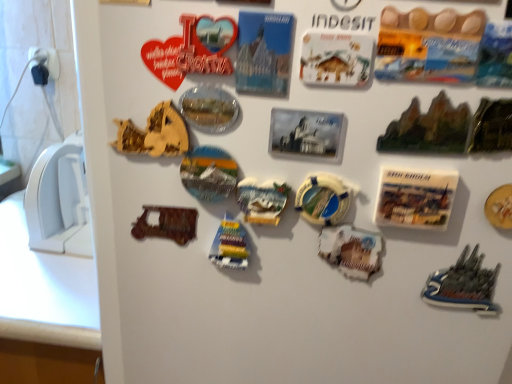
Question: Is wooden toy boat at center, marked as the 6th stuff in a right-to-left arrangement, shorter than wooden puzzle piece at upper left, acting as the 1th stuff starting from the left?

Choices:
 (A) yes
 (B) no

Answer: (B)

Question: From a real-world perspective, is wooden toy boat at center, marked as the 2th stuff in a left-to-right arrangement, below wooden puzzle piece at upper left, which is the 7th stuff from right to left?

Choices:
 (A) no
 (B) yes

Answer: (B)

Question: From the image's perspective, is wooden toy boat at center, marked as the 6th stuff in a right-to-left arrangement, over wooden puzzle piece at upper left, which is the 7th stuff from right to left?

Choices:
 (A) no
 (B) yes

Answer: (A)

Question: Is wooden toy boat at center, marked as the 6th stuff in a right-to-left arrangement, far away from wooden puzzle piece at upper left, acting as the 1th stuff starting from the left?

Choices:
 (A) no
 (B) yes

Answer: (A)

Question: Is wooden toy boat at center, marked as the 6th stuff in a right-to-left arrangement, taller than wooden puzzle piece at upper left, acting as the 1th stuff starting from the left?

Choices:
 (A) no
 (B) yes

Answer: (B)

Question: Is yellow lifebuoy at center, which is counted as the 4th stuff, starting from the left, bigger or smaller than metallic silver magnet at center, which ranks as the third stuff in left-to-right order?

Choices:
 (A) small
 (B) big

Answer: (A)

Question: Is yellow lifebuoy at center, the fourth stuff positioned from the right, wider or thinner than metallic silver magnet at center, which ranks as the third stuff in left-to-right order?

Choices:
 (A) thin
 (B) wide

Answer: (A)

Question: Is yellow lifebuoy at center, which is counted as the 4th stuff, starting from the left, in front of or behind metallic silver magnet at center, which ranks as the third stuff in left-to-right order, in the image?

Choices:
 (A) front
 (B) behind

Answer: (A)

Question: From their relative heights in the image, would you say yellow lifebuoy at center, the fourth stuff positioned from the right, is taller or shorter than metallic silver magnet at center, which ranks as the third stuff in left-to-right order?

Choices:
 (A) short
 (B) tall

Answer: (B)

Question: In terms of size, does yellow lifebuoy at center, the fourth stuff positioned from the right, appear bigger or smaller than green glossy rock formation at upper right, which is the 2th stuff in right-to-left order?

Choices:
 (A) big
 (B) small

Answer: (B)

Question: Is point (316, 185) positioned closer to the camera than point (453, 137)?

Choices:
 (A) closer
 (B) farther

Answer: (B)

Question: In the image, is yellow lifebuoy at center, which is counted as the 4th stuff, starting from the left, positioned in front of or behind green glossy rock formation at upper right, which is the 2th stuff in right-to-left order?

Choices:
 (A) behind
 (B) front

Answer: (A)

Question: From a real-world perspective, is yellow lifebuoy at center, which is counted as the 4th stuff, starting from the left, above or below green glossy rock formation at upper right, which is the 2th stuff in right-to-left order?

Choices:
 (A) above
 (B) below

Answer: (B)

Question: Is point (408, 203) closer or farther from the camera than point (228, 261)?

Choices:
 (A) closer
 (B) farther

Answer: (A)

Question: Is white paper postcard at center right in front of or behind wooden toy boat at center, marked as the 2th stuff in a left-to-right arrangement, in the image?

Choices:
 (A) front
 (B) behind

Answer: (A)